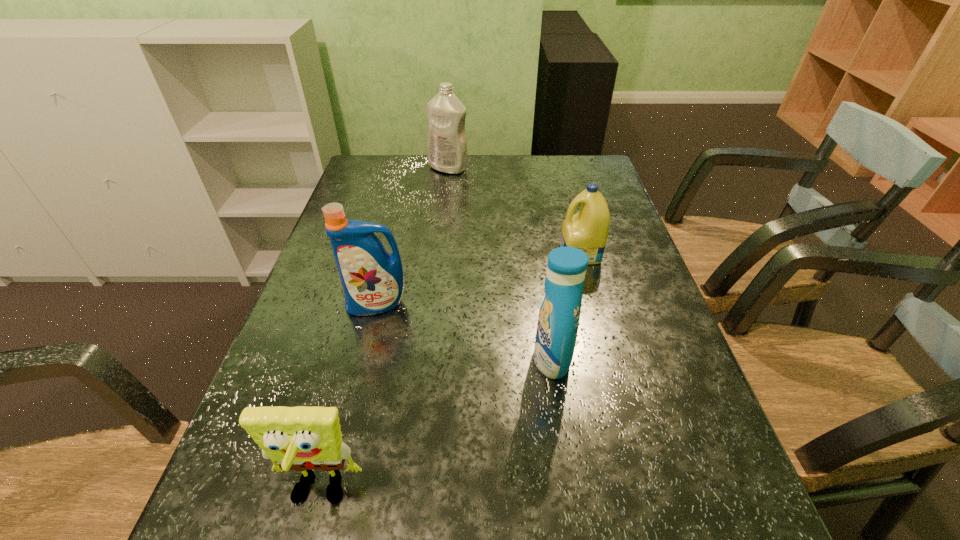
Select which object is the second closest to the fourth farthest object. Please provide its 2D coordinates. Your answer should be formatted as a tuple, i.e. [(x, y)], where the tuple contains the x and y coordinates of a point satisfying the conditions above.

[(372, 279)]

Locate an element on the screen. This screenshot has height=540, width=960. the closest object to the shortest detergent is located at coordinates (559, 314).

Find the location of `detergent that stands as the second closest to the second detergent from right to left`. detergent that stands as the second closest to the second detergent from right to left is located at coordinates (372, 279).

You are a GUI agent. You are given a task and a screenshot of the screen. Output one action in this format:
    pyautogui.click(x=<x>, y=<y>)
    Task: Click on the detergent object that ranks as the second closest to the second nearest detergent
    
    Given the screenshot: What is the action you would take?
    pyautogui.click(x=587, y=230)

Image resolution: width=960 pixels, height=540 pixels. I want to click on vacant space that satisfies the following two spatial constraints: 1. on the label of the second farthest object; 2. on the face of the nearest object, so click(x=644, y=493).